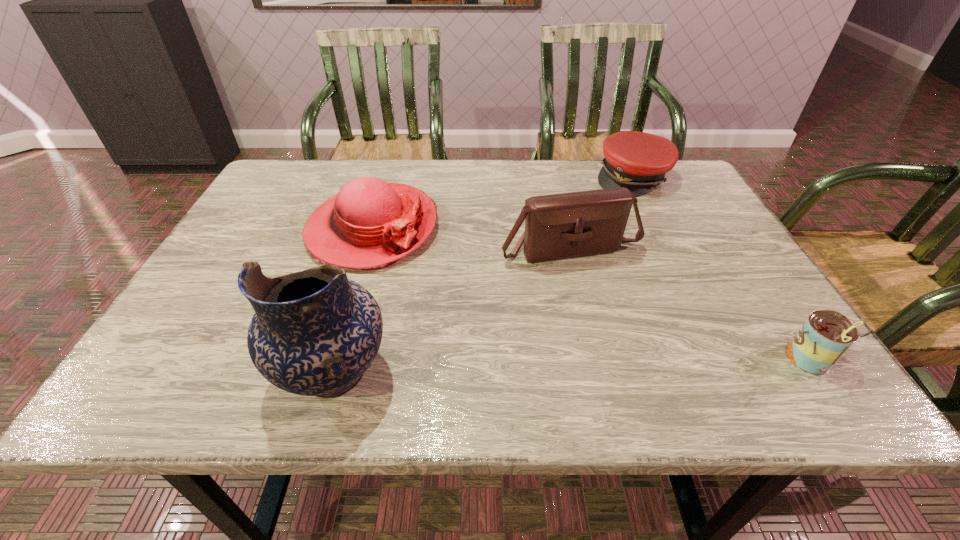
I want to click on can present at the right edge, so click(x=826, y=335).

Locate an element on the screen. cap that is at the right edge is located at coordinates (638, 161).

Identify the location of object located in the far right corner section of the desktop. The height and width of the screenshot is (540, 960). (638, 161).

The width and height of the screenshot is (960, 540). Find the location of `object situated at the near right corner`. object situated at the near right corner is located at coordinates (826, 335).

At what (x,y) coordinates should I click in order to perform the action: click on free space at the far edge. Please return your answer as a coordinate pair (x, y). Looking at the image, I should click on (538, 191).

At what (x,y) coordinates should I click in order to perform the action: click on free space at the near edge of the desktop. Please return your answer as a coordinate pair (x, y). This screenshot has height=540, width=960. Looking at the image, I should click on (496, 333).

In the image, there is a desktop. At what (x,y) coordinates should I click in order to perform the action: click on vacant space at the right edge. Please return your answer as a coordinate pair (x, y). The width and height of the screenshot is (960, 540). Looking at the image, I should click on (685, 242).

What are the coordinates of `vacant space at the far left corner of the desktop` in the screenshot? It's located at (324, 165).

Locate an element on the screen. This screenshot has width=960, height=540. free space at the near left corner of the desktop is located at coordinates (173, 346).

The image size is (960, 540). Identify the location of free space at the far right corner. (689, 195).